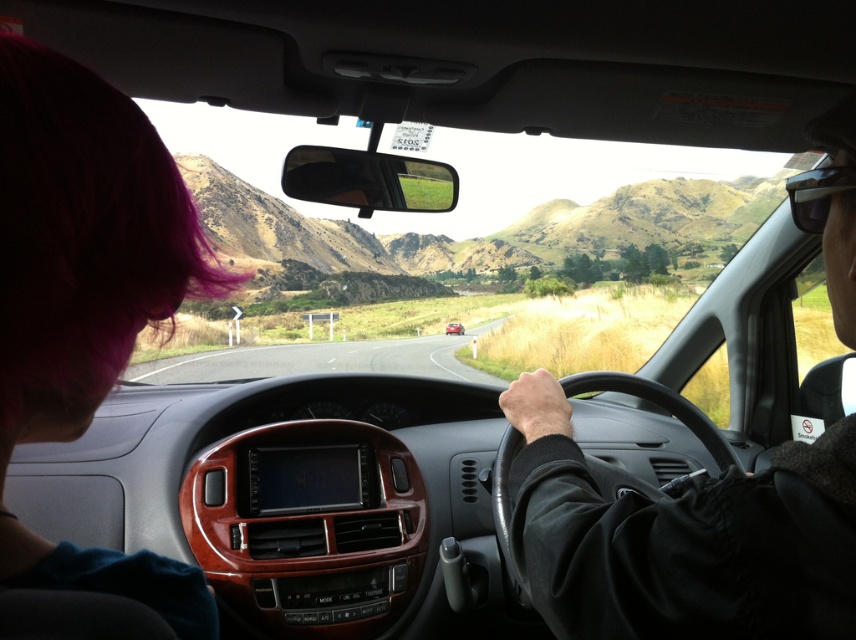
Question: Which of the following is the farthest from the observer?

Choices:
 (A) (4, 536)
 (B) (798, 515)

Answer: (B)

Question: Does black leather jacket at center come in front of metallic red car at center?

Choices:
 (A) yes
 (B) no

Answer: (A)

Question: Which point is closer to the camera?

Choices:
 (A) metallic red car at center
 (B) black leather jacket at center

Answer: (B)

Question: Which is farther from the metallic red car at center?

Choices:
 (A) black leather jacket at center
 (B) pink hair at left

Answer: (B)

Question: Does pink hair at left come in front of metallic red car at center?

Choices:
 (A) no
 (B) yes

Answer: (B)

Question: Is black leather jacket at center positioned behind metallic red car at center?

Choices:
 (A) no
 (B) yes

Answer: (A)